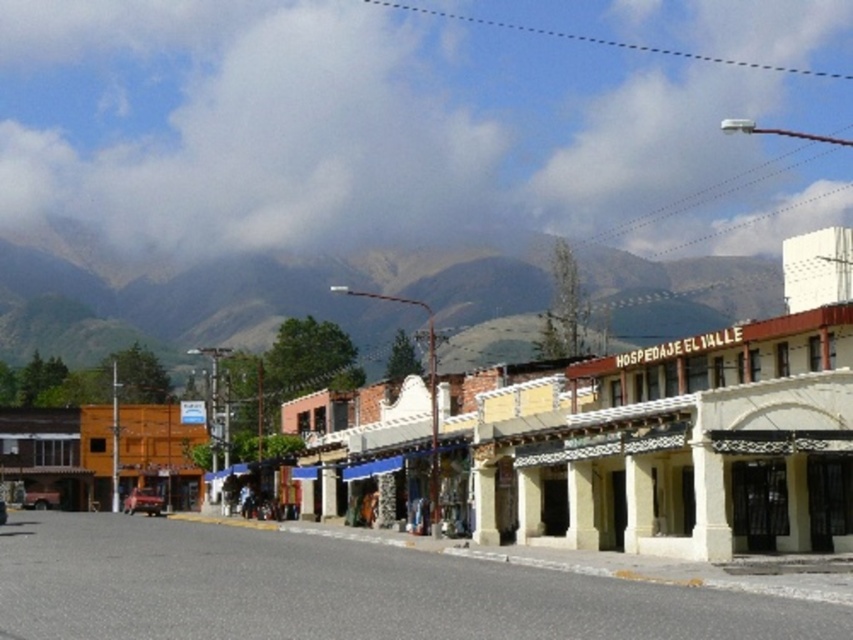
Question: Does yellow stucco building at center have a larger size compared to green textured mountain at upper center?

Choices:
 (A) no
 (B) yes

Answer: (B)

Question: Is yellow stucco building at center to the right of green textured mountain at upper center from the viewer's perspective?

Choices:
 (A) no
 (B) yes

Answer: (B)

Question: Which point is farther from the camera taking this photo?

Choices:
 (A) (782, 340)
 (B) (305, 289)

Answer: (B)

Question: Which point is closer to the camera?

Choices:
 (A) (792, 529)
 (B) (643, 328)

Answer: (A)

Question: Considering the relative positions of yellow stucco building at center and green textured mountain at upper center in the image provided, where is yellow stucco building at center located with respect to green textured mountain at upper center?

Choices:
 (A) left
 (B) right

Answer: (B)